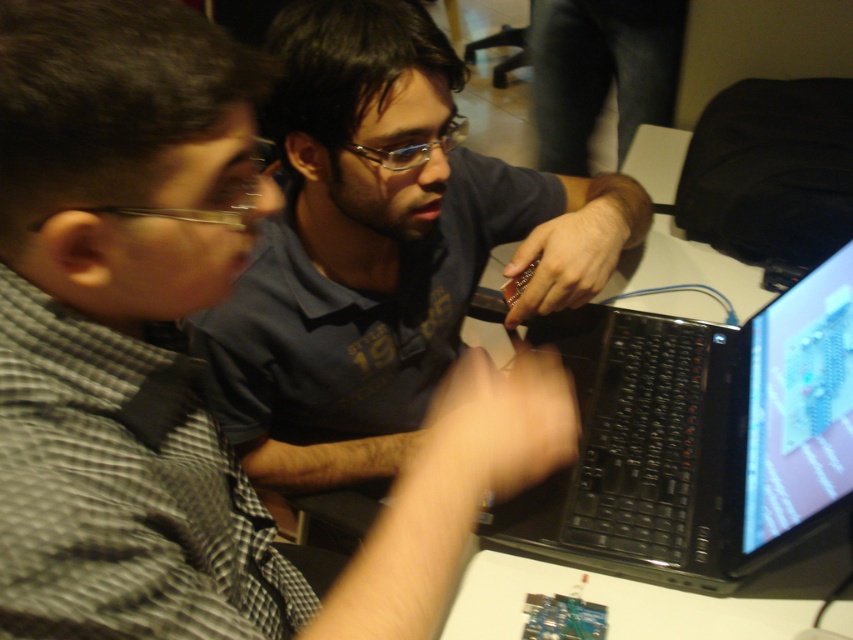
You are a technician trying to access the shiny plastic monitor at upper right but there is a matte black shirt at center blocking your view. Can you see the monitor through the shirt?

The shiny plastic monitor at upper right is behind matte black shirt at center, so you cannot see the monitor through the shirt.

You are a photographer taking a picture of the scene. You want to ensure both the matte black shirt at center and the black matte laptop at center are clearly visible in the frame. Based on their positions, which one should you focus on first to ensure proper focus?

The matte black shirt at center is located above the black matte laptop at center, so you should focus on the matte black shirt at center first to ensure proper focus.

You are observing two points in the image. The first point is at coordinate point (782, 515) and the second point is at coordinate point (550, 16). Which point is closer to you?

Point (782, 515) is closer to the viewer than point (550, 16).